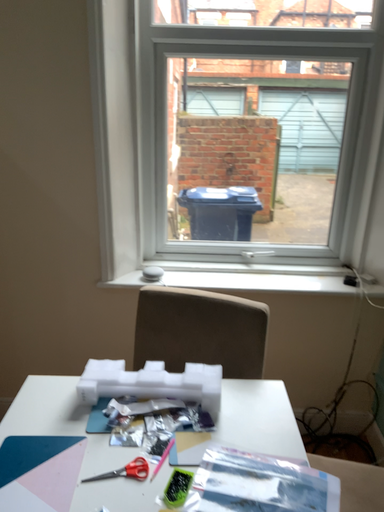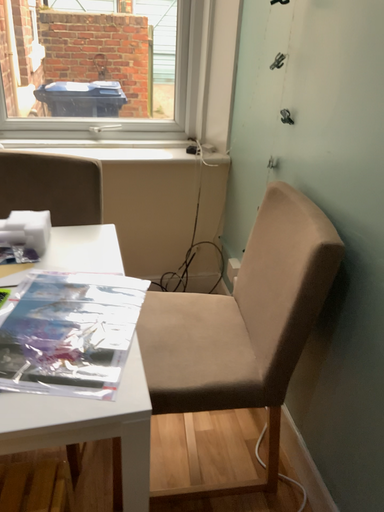
Question: Which way did the camera rotate in the video?

Choices:
 (A) rotated downward
 (B) rotated upward

Answer: (A)